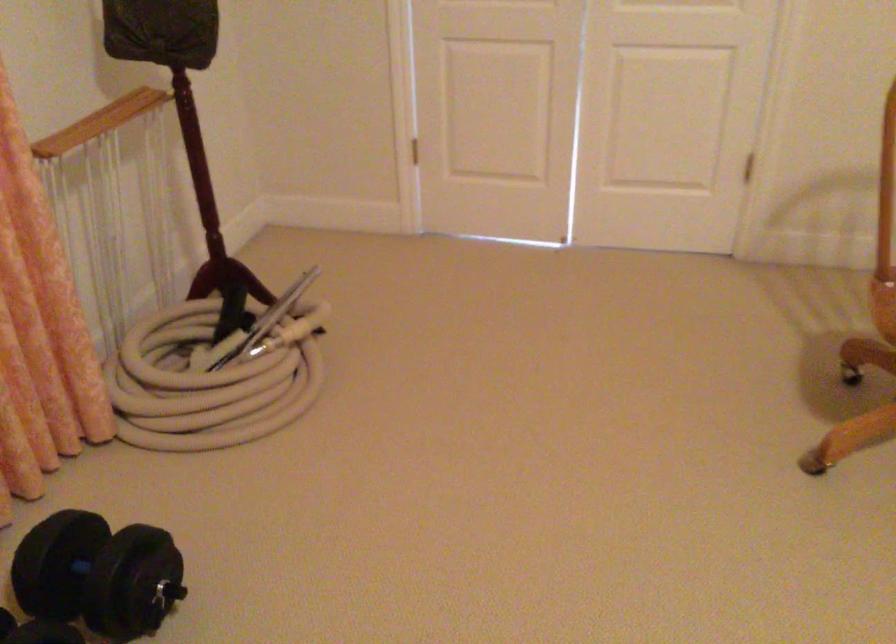
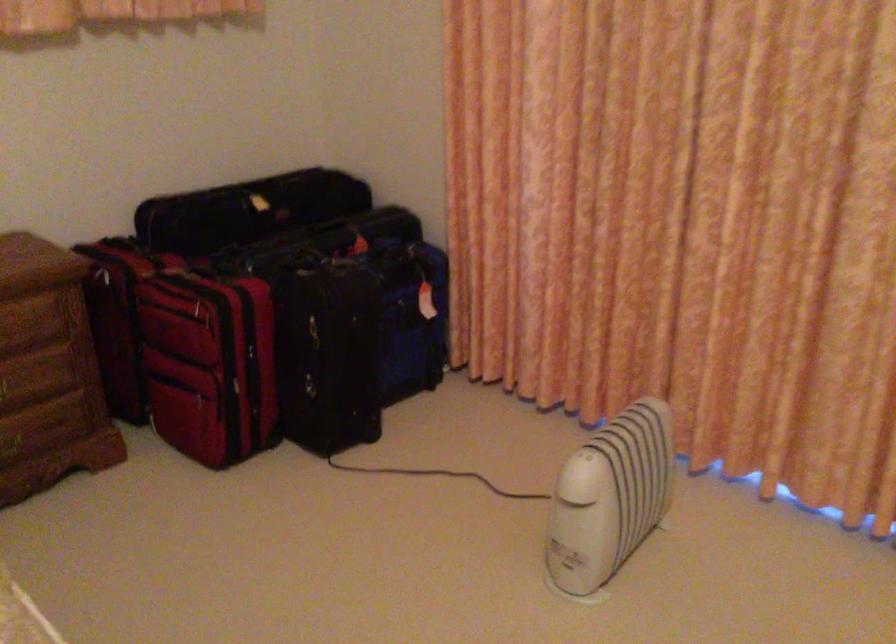
First-person continuous shooting, in which direction is the camera rotating?

The camera's rotation is toward left-down.